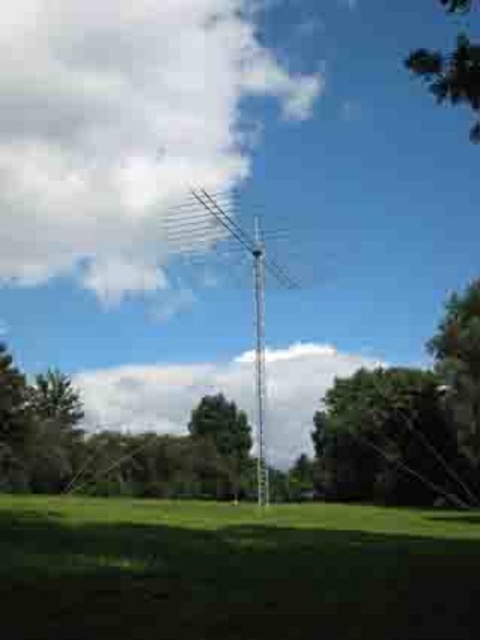
Question: Is the position of white fluffy cloud at upper center less distant than that of green leafy tree at center?

Choices:
 (A) no
 (B) yes

Answer: (A)

Question: Can you confirm if silver metallic antenna at center is positioned to the right of green leafy tree at center?

Choices:
 (A) no
 (B) yes

Answer: (B)

Question: Which object appears farthest from the camera in this image?

Choices:
 (A) white fluffy cloud at upper center
 (B) green grassy at lower center

Answer: (A)

Question: Which object is the closest to the white fluffy cloud at upper center?

Choices:
 (A) green leafy tree at upper right
 (B) green leafy tree at center

Answer: (B)

Question: Is white fluffy cloud at upper center positioned before green leafy tree at center?

Choices:
 (A) yes
 (B) no

Answer: (B)

Question: Which object appears farthest from the camera in this image?

Choices:
 (A) green leafy tree at upper right
 (B) white fluffy cloud at upper center

Answer: (B)